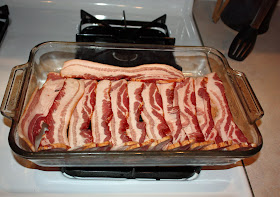
At what (x,y) coordinates should I click in order to perform the action: click on utensil container. Please return your answer as a coordinate pair (x, y). Looking at the image, I should click on point(238,13).